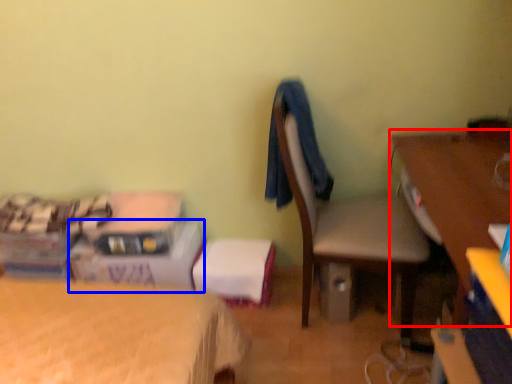
Question: Which point is further to the camera, desk (highlighted by a red box) or box (highlighted by a blue box)?

Choices:
 (A) desk
 (B) box

Answer: (B)